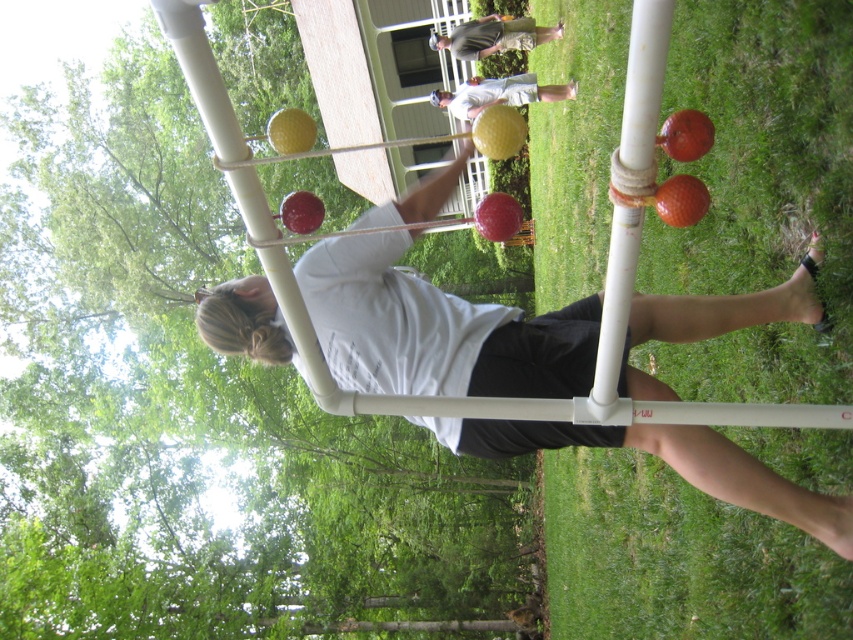
From the picture: You are a photographer trying to capture a candid shot of the person in the white matte shirt at center and the light gray shirt at upper center. Which person should you focus on first to ensure they are in the foreground of your photo?

The white matte shirt at center should be focused on first because it is positioned under the light gray shirt at upper center, meaning it is closer to the camera and thus in the foreground.

You are a photographer trying to capture a candid shot of the two people in the scene. The light gray shirt at upper center and the matte white shirt at center are both in your viewfinder. Based on their positions, which one appears taller in the photo?

The light gray shirt at upper center appears taller in the photo because it has a greater height compared to the matte white shirt at center according to the description.